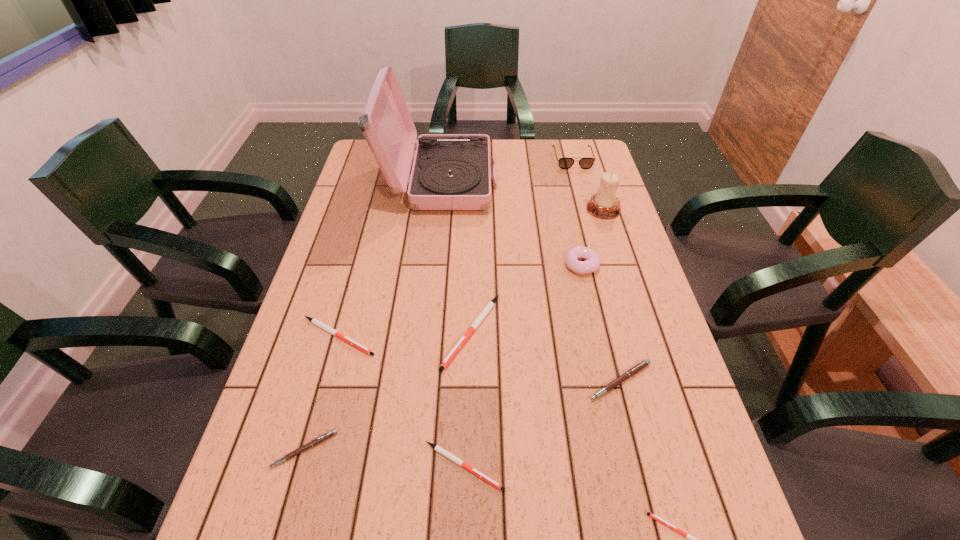
This screenshot has height=540, width=960. What are the coordinates of `vacant space that satisfies the following two spatial constraints: 1. on the clicker of the biggest white pen; 2. on the clicker of the third biggest white pen` in the screenshot? It's located at (468, 466).

Where is `free space that satisfies the following two spatial constraints: 1. on the front-facing side of the black spectacles; 2. on the left side of the second tallest object`? Image resolution: width=960 pixels, height=540 pixels. free space that satisfies the following two spatial constraints: 1. on the front-facing side of the black spectacles; 2. on the left side of the second tallest object is located at coordinates (x=587, y=209).

Where is `free spot that satisfies the following two spatial constraints: 1. with the lid open on the record player; 2. on the right side of the fourth tallest object`? free spot that satisfies the following two spatial constraints: 1. with the lid open on the record player; 2. on the right side of the fourth tallest object is located at coordinates (431, 265).

Find the location of a particular element. This screenshot has height=540, width=960. free space that satisfies the following two spatial constraints: 1. on the front-facing side of the black spectacles; 2. on the clicker of the third farthest white pen is located at coordinates (657, 466).

The width and height of the screenshot is (960, 540). What are the coordinates of `vacant area that satisfies the following two spatial constraints: 1. on the back side of the purple doughnut; 2. with the lid open on the tallest object` in the screenshot? It's located at (563, 181).